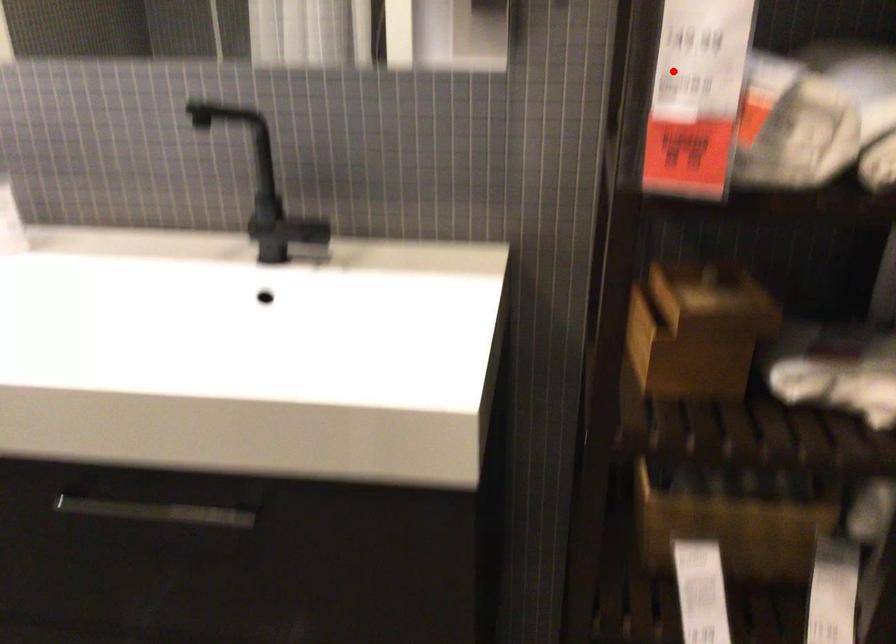
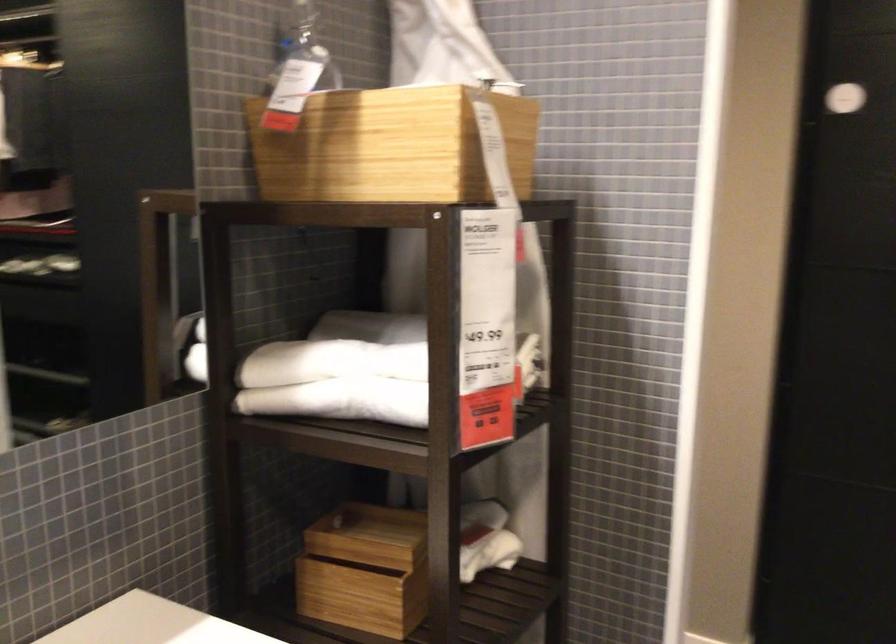
Question: I am providing you with two images of the same scene from different viewpoints. A red point is shown in image1. For the corresponding object point in image2, is it positioned nearer or farther from the camera?

Choices:
 (A) Nearer
 (B) Farther

Answer: (B)